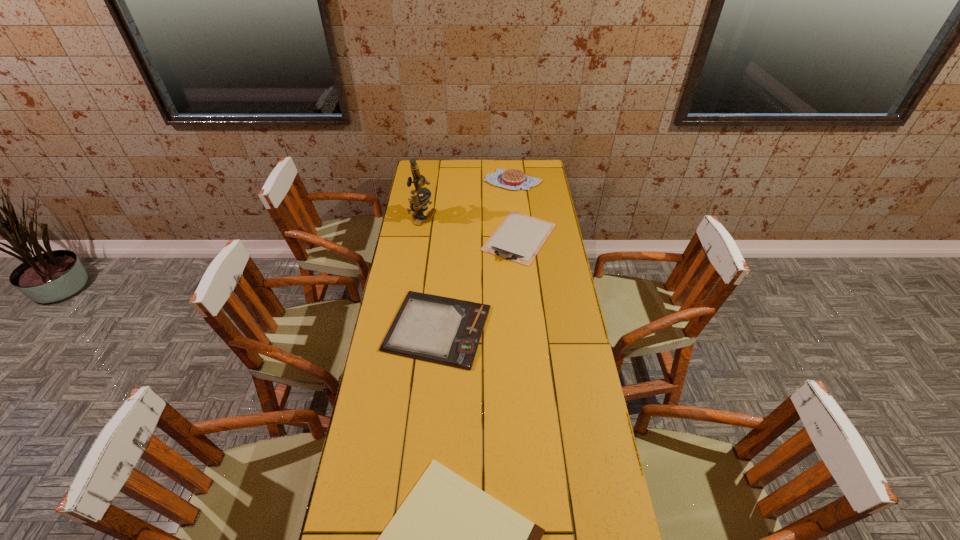
Where is `microscope located in the left edge section of the desktop`? The width and height of the screenshot is (960, 540). microscope located in the left edge section of the desktop is located at coordinates (418, 204).

This screenshot has height=540, width=960. I want to click on clipboard at the left edge, so point(447,331).

The width and height of the screenshot is (960, 540). I want to click on pie that is positioned at the right edge, so click(x=513, y=179).

You are a GUI agent. You are given a task and a screenshot of the screen. Output one action in this format:
    pyautogui.click(x=<x>, y=<y>)
    Task: Click on the clipboard present at the right edge
    
    Given the screenshot: What is the action you would take?
    pyautogui.click(x=519, y=237)

I want to click on object at the far right corner, so click(x=513, y=179).

In the image, there is a desktop. Where is `blank space at the far edge`? The width and height of the screenshot is (960, 540). blank space at the far edge is located at coordinates (474, 165).

The image size is (960, 540). In the image, there is a desktop. What are the coordinates of `vacant space at the left edge` in the screenshot? It's located at (427, 243).

This screenshot has width=960, height=540. In the image, there is a desktop. What are the coordinates of `vacant space at the right edge` in the screenshot? It's located at (560, 274).

Identify the location of free region at the far left corner of the desktop. This screenshot has height=540, width=960. (434, 161).

I want to click on free space at the far right corner of the desktop, so click(535, 160).